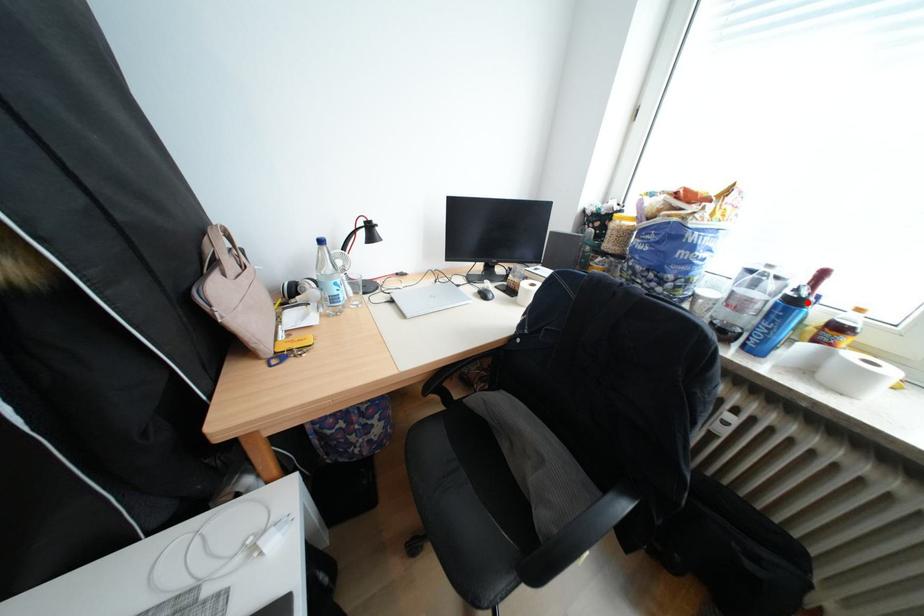
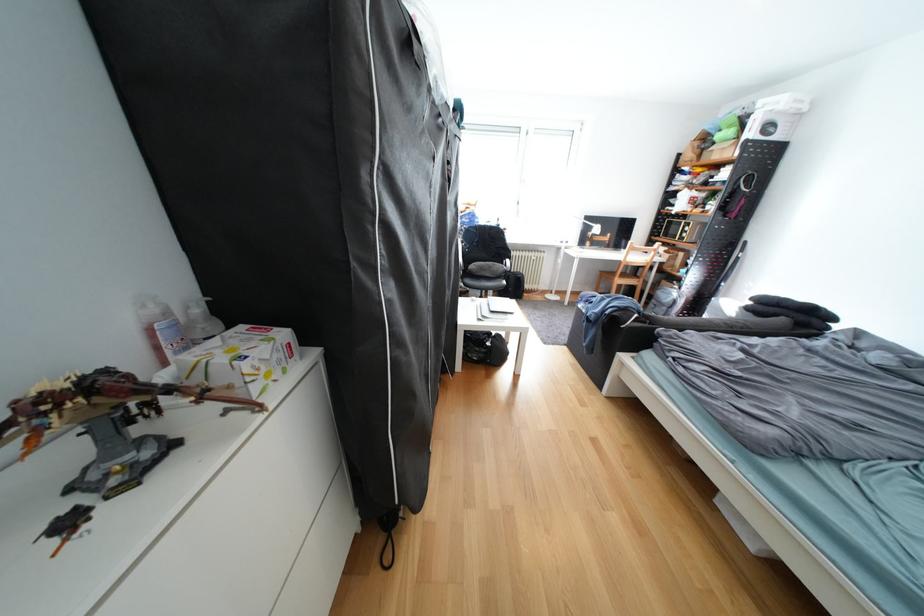
Question: I am providing you with two images of the same scene from different viewpoints. A red point is marked on the first image. Is the red point's position out of view in image 2?

Choices:
 (A) Yes
 (B) No

Answer: (A)